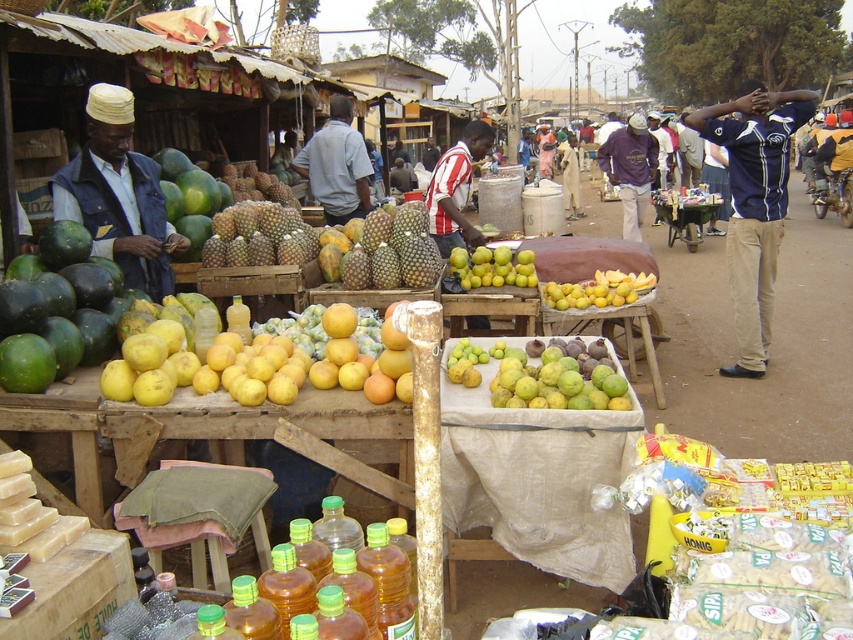
Is point (585, 356) less distant than point (636, 291)?

Yes, point (585, 356) is in front of point (636, 291).

How much distance is there between yellow matte quince at center and yellow matte mangoes at center?

They are 1.88 meters apart.

Image resolution: width=853 pixels, height=640 pixels. Find the location of `yellow matte quince at center`. yellow matte quince at center is located at coordinates (560, 378).

Does blue jersey at center appear over green matte pineapple at center?

Yes, blue jersey at center is above green matte pineapple at center.

Is the position of blue jersey at center less distant than that of green matte pineapple at center?

That is False.

Is point (753, 83) behind point (405, 268)?

Yes, it is behind point (405, 268).

This screenshot has width=853, height=640. Find the location of `blue jersey at center`. blue jersey at center is located at coordinates (753, 204).

Which of these two, purple cotton shirt at center or yellow matte mangoes at center, stands shorter?

yellow matte mangoes at center

Can you confirm if purple cotton shirt at center is bigger than yellow matte mangoes at center?

Correct, purple cotton shirt at center is larger in size than yellow matte mangoes at center.

You are a GUI agent. You are given a task and a screenshot of the screen. Output one action in this format:
    pyautogui.click(x=<x>, y=<y>)
    Task: Click on the purple cotton shirt at center
    The height and width of the screenshot is (640, 853).
    Given the screenshot: What is the action you would take?
    pyautogui.click(x=630, y=170)